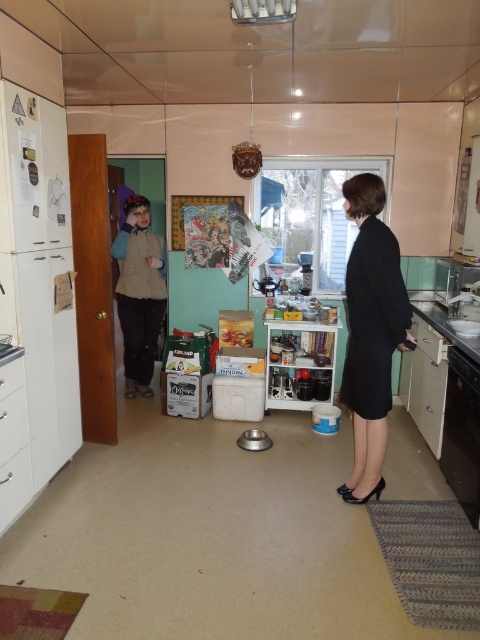
Question: Among these objects, which one is farthest from the camera?

Choices:
 (A) metallic stainless steel sink at right
 (B) metallic silver exhaust hood at upper center
 (C) black fabric dress at right
 (D) black plastic dishwasher at lower right

Answer: (A)

Question: Considering the relative positions of beige fabric vest at left and black plastic dishwasher at lower right in the image provided, where is beige fabric vest at left located with respect to black plastic dishwasher at lower right?

Choices:
 (A) right
 (B) left

Answer: (B)

Question: Is black fabric dress at right wider than black plastic dishwasher at lower right?

Choices:
 (A) yes
 (B) no

Answer: (A)

Question: Can you confirm if black fabric dress at right is positioned to the left of metallic stainless steel sink at right?

Choices:
 (A) yes
 (B) no

Answer: (A)

Question: Which object is farther from the camera taking this photo?

Choices:
 (A) metallic silver exhaust hood at upper center
 (B) black plastic dishwasher at lower right

Answer: (B)

Question: Among these points, which one is farthest from the camera?

Choices:
 (A) (260, 16)
 (B) (389, 372)

Answer: (B)